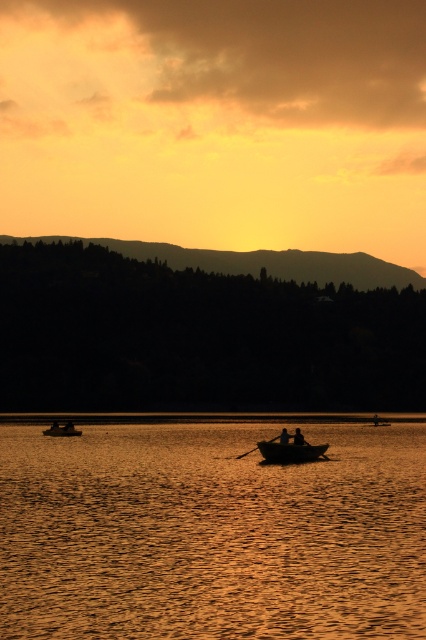
Question: Which point is farther from the camera taking this photo?

Choices:
 (A) (285, 429)
 (B) (328, 566)

Answer: (A)

Question: Observing the image, what is the correct spatial positioning of silhouette human at center in reference to smooth skin figure at center?

Choices:
 (A) right
 (B) left

Answer: (A)

Question: Is smooth wooden canoe at center closer to the viewer compared to smooth skin figure at center?

Choices:
 (A) yes
 (B) no

Answer: (A)

Question: Which of these objects is positioned farthest from the golden reflective water at center?

Choices:
 (A) smooth wooden boat at lower left
 (B) silhouette human at center

Answer: (A)

Question: Among these objects, which one is nearest to the camera?

Choices:
 (A) golden reflective water at center
 (B) silhouette human at center
 (C) smooth wooden canoe at center

Answer: (A)

Question: Is golden reflective water at center wider than smooth skin figure at center?

Choices:
 (A) no
 (B) yes

Answer: (B)